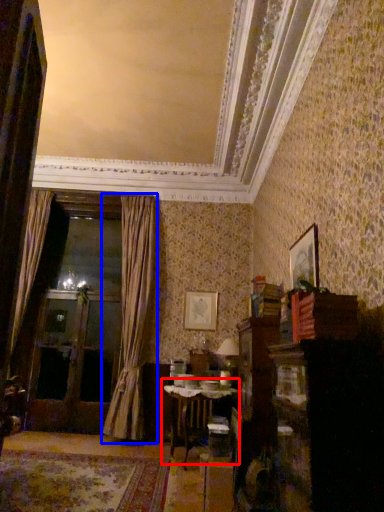
Question: Which object appears closest to the camera in this image, table (highlighted by a red box) or curtain (highlighted by a blue box)?

Choices:
 (A) table
 (B) curtain

Answer: (A)